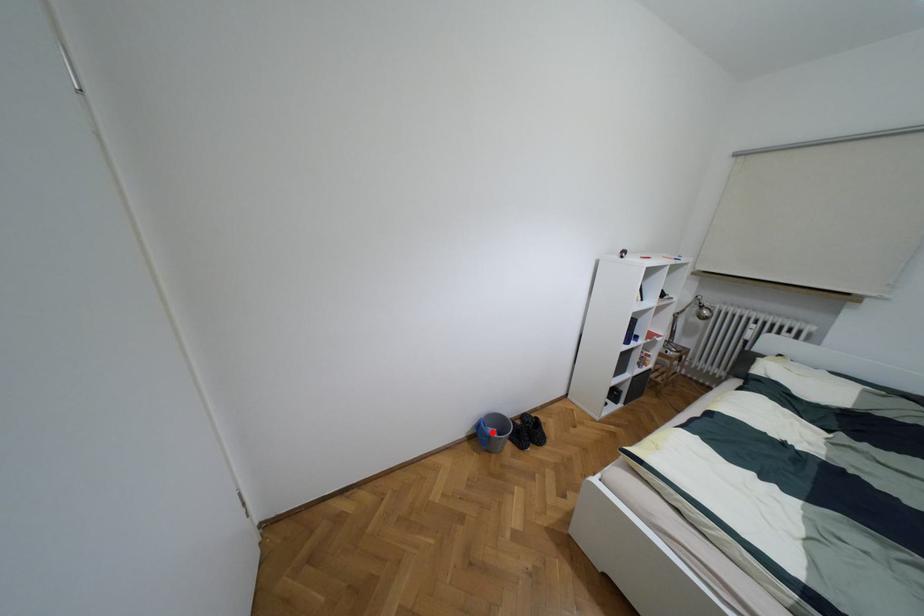
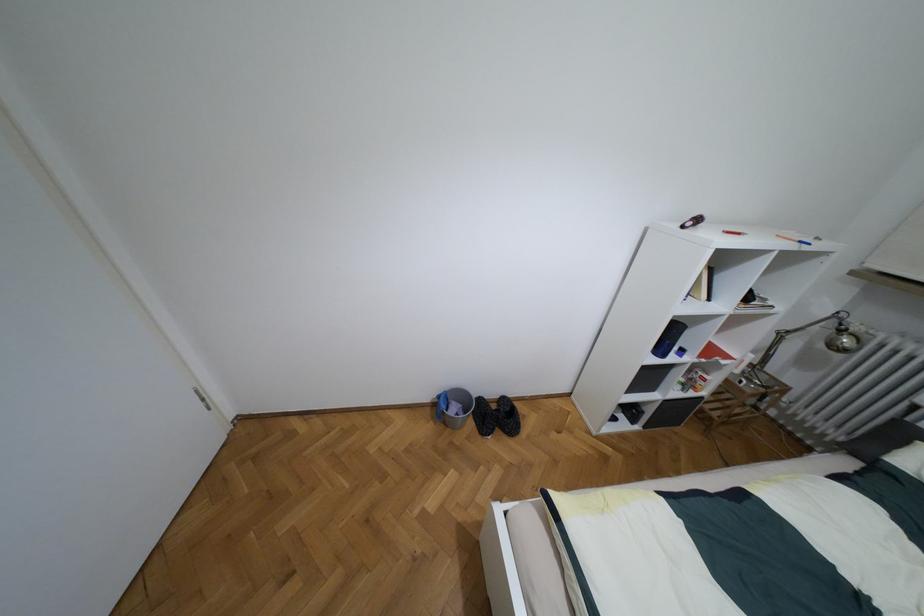
In the second image, find the point that corresponds to the highlighted location in the first image.

(453, 408)